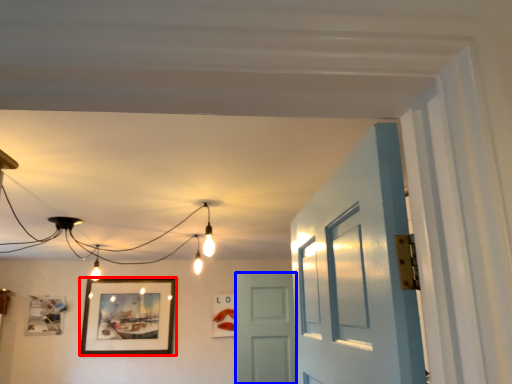
Question: Which point is further to the camera, picture frame (highlighted by a red box) or door (highlighted by a blue box)?

Choices:
 (A) picture frame
 (B) door

Answer: (A)